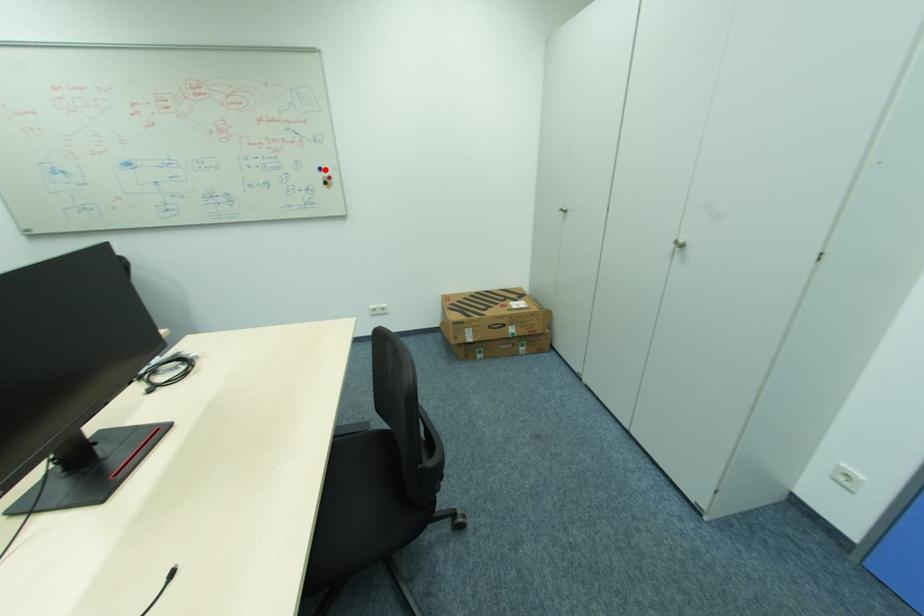
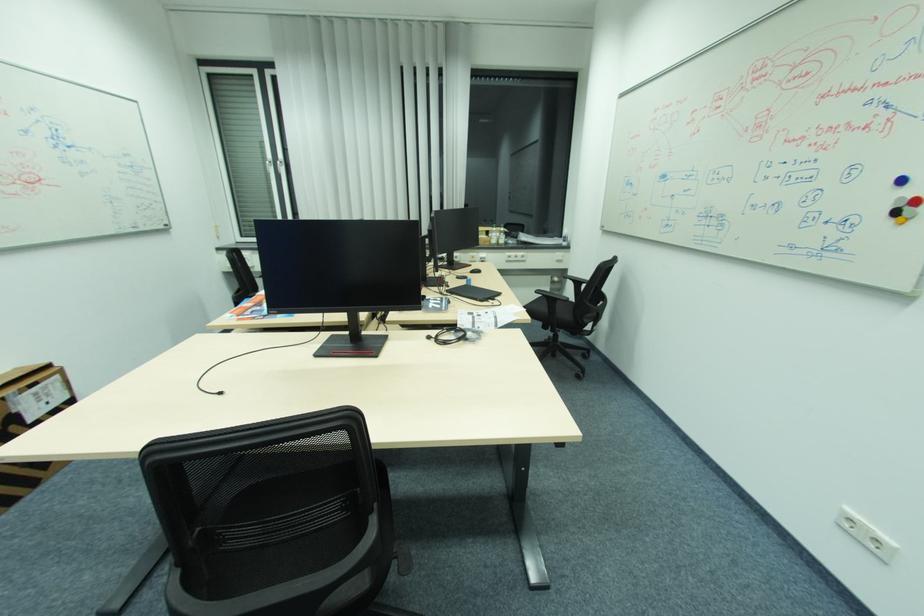
The point at the highlighted location is marked in the first image. Where is the corresponding point in the second image?

(908, 180)